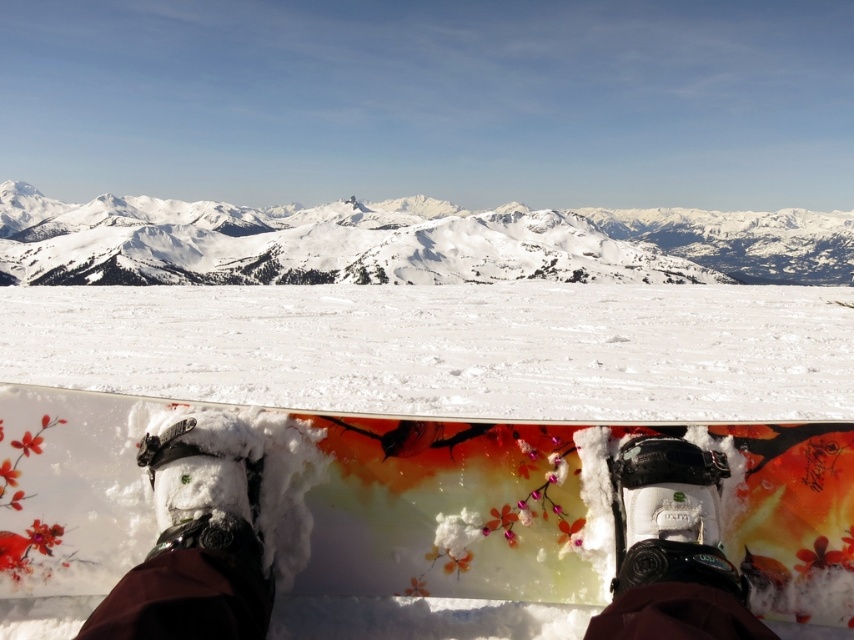
Question: Which object is positioned farthest from the matte black boot at lower center?

Choices:
 (A) floral painted wood snowboard at center
 (B) white glossy snow at center

Answer: (B)

Question: Which object is the closest to the matte black boot at lower center?

Choices:
 (A) snowy white mountain at upper center
 (B) floral painted wood snowboard at center

Answer: (B)

Question: Considering the relative positions of white glossy snow at center and matte black boot at lower center in the image provided, where is white glossy snow at center located with respect to matte black boot at lower center?

Choices:
 (A) right
 (B) left

Answer: (B)

Question: Is snowy white mountain at upper center bigger than matte black boot at lower center?

Choices:
 (A) yes
 (B) no

Answer: (A)

Question: Which object is closer to the camera taking this photo?

Choices:
 (A) floral painted wood snowboard at center
 (B) snowy white mountain at upper center
 (C) white glossy snow at center

Answer: (C)

Question: Can you confirm if white glossy snow at center is wider than floral painted wood snowboard at center?

Choices:
 (A) yes
 (B) no

Answer: (A)